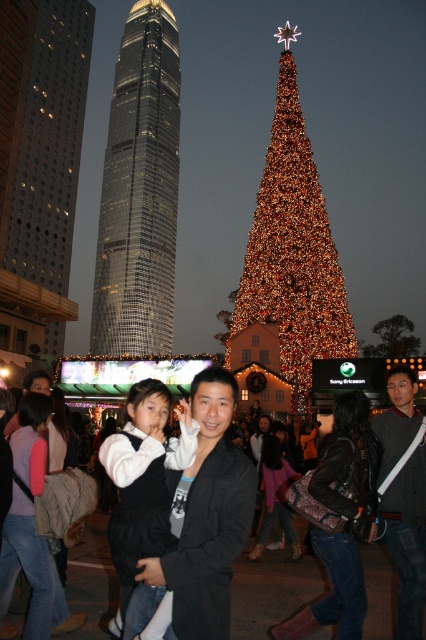
Question: Is black matte jacket at center bigger than denim jeans at lower right?

Choices:
 (A) yes
 (B) no

Answer: (B)

Question: Which of these objects is positioned closest to the velvet black coat at center?

Choices:
 (A) illuminated gold christmas tree at center
 (B) black fabric bag at center

Answer: (B)

Question: Which point is farther to the camera?

Choices:
 (A) denim jeans at lower right
 (B) glassy skyscraper at center
 (C) glass skyscraper at left

Answer: (B)

Question: Which point is closer to the camera?

Choices:
 (A) illuminated gold christmas tree at center
 (B) black matte jacket at center
 (C) white fleece vest at center

Answer: (B)

Question: Can you confirm if illuminated gold christmas tree at center is thinner than denim jeans at lower right?

Choices:
 (A) yes
 (B) no

Answer: (B)

Question: Is glass skyscraper at left positioned in front of white fleece vest at center?

Choices:
 (A) no
 (B) yes

Answer: (A)